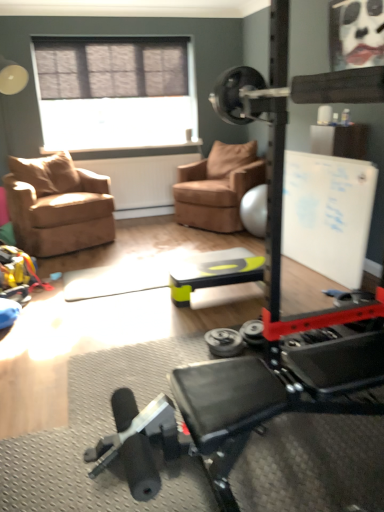
Question: Are suede brown armchair at left, placed as the 1th chair when sorted from left to right, and suede brown armchair at center, which is counted as the 2th chair, starting from the left, far apart?

Choices:
 (A) yes
 (B) no

Answer: (A)

Question: Does suede brown armchair at left, which appears as the second chair when viewed from the right, have a lesser height compared to suede brown armchair at center, which is counted as the 2th chair, starting from the left?

Choices:
 (A) yes
 (B) no

Answer: (A)

Question: Considering the relative sizes of suede brown armchair at left, which appears as the second chair when viewed from the right, and suede brown armchair at center, which is counted as the 2th chair, starting from the left, in the image provided, is suede brown armchair at left, which appears as the second chair when viewed from the right, thinner than suede brown armchair at center, which is counted as the 2th chair, starting from the left,?

Choices:
 (A) no
 (B) yes

Answer: (B)

Question: Is suede brown armchair at left, which appears as the second chair when viewed from the right, positioned in front of suede brown armchair at center, the first chair positioned from the right?

Choices:
 (A) yes
 (B) no

Answer: (A)

Question: Is suede brown armchair at left, placed as the 1th chair when sorted from left to right, smaller than suede brown armchair at center, which is counted as the 2th chair, starting from the left?

Choices:
 (A) yes
 (B) no

Answer: (A)

Question: Is green plastic table at center spatially inside silver metallic dumbbell at center, or outside of it?

Choices:
 (A) inside
 (B) outside

Answer: (B)

Question: In terms of height, does green plastic table at center look taller or shorter compared to silver metallic dumbbell at center?

Choices:
 (A) tall
 (B) short

Answer: (A)

Question: Looking at their shapes, would you say green plastic table at center is wider or thinner than silver metallic dumbbell at center?

Choices:
 (A) wide
 (B) thin

Answer: (A)

Question: Does point (175, 303) appear closer or farther from the camera than point (213, 353)?

Choices:
 (A) closer
 (B) farther

Answer: (B)

Question: In the image, is silver metallic dumbbell at center positioned in front of or behind white matte bulletin board at upper right?

Choices:
 (A) behind
 (B) front

Answer: (B)

Question: Considering the positions of point (210, 339) and point (347, 258), is point (210, 339) closer or farther from the camera than point (347, 258)?

Choices:
 (A) closer
 (B) farther

Answer: (A)

Question: Looking at their shapes, would you say silver metallic dumbbell at center is wider or thinner than white matte bulletin board at upper right?

Choices:
 (A) thin
 (B) wide

Answer: (A)

Question: In terms of height, does silver metallic dumbbell at center look taller or shorter compared to white matte bulletin board at upper right?

Choices:
 (A) tall
 (B) short

Answer: (B)

Question: Would you say matte black face at upper right is inside or outside suede brown armchair at center, the first chair positioned from the right?

Choices:
 (A) inside
 (B) outside

Answer: (B)

Question: Relative to suede brown armchair at center, the first chair positioned from the right, is matte black face at upper right in front or behind?

Choices:
 (A) behind
 (B) front

Answer: (B)